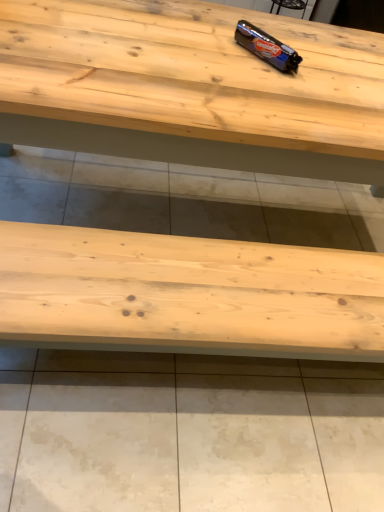
Locate an element on the screen. This screenshot has width=384, height=512. unoccupied region to the right of shiny metallic chocolate bar at upper center is located at coordinates (328, 71).